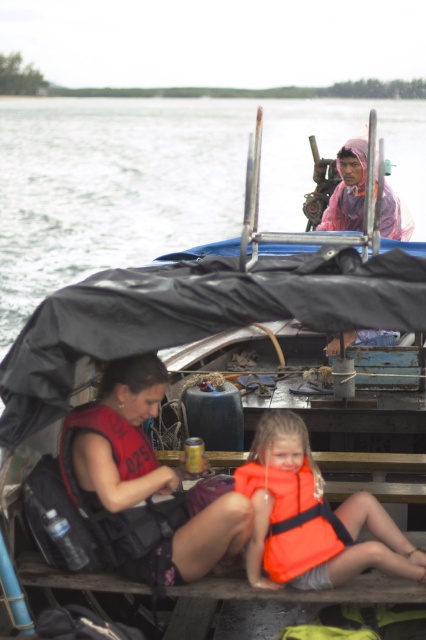
Measure the distance between point (103, 525) and camera.

Point (103, 525) is 17.37 feet away from camera.

Does matte red life vest at lower left come behind orange life vest at center?

That is False.

Who is more distant from viewer, (147, 445) or (270, 481)?

Positioned behind is point (147, 445).

This screenshot has width=426, height=640. I want to click on matte red life vest at lower left, so click(x=144, y=483).

Can you confirm if orange life vest at center is positioned to the right of orange fabric life jacket at center?

Correct, you'll find orange life vest at center to the right of orange fabric life jacket at center.

Between orange life vest at center and orange fabric life jacket at center, which one has more height?

orange life vest at center

Is point (397, 536) less distant than point (325, 524)?

No.

Identify the location of orange life vest at center. (310, 516).

Can you confirm if matte red life vest at lower left is wider than orange fabric life jacket at center?

Indeed, matte red life vest at lower left has a greater width compared to orange fabric life jacket at center.

How much distance is there between matte red life vest at lower left and orange fabric life jacket at center?

A distance of 18.26 inches exists between matte red life vest at lower left and orange fabric life jacket at center.

Measure the distance between point [71,433] and camera.

Point [71,433] is 5.45 meters away from camera.

Locate an element on the screen. The image size is (426, 640). matte red life vest at lower left is located at coordinates (144, 483).